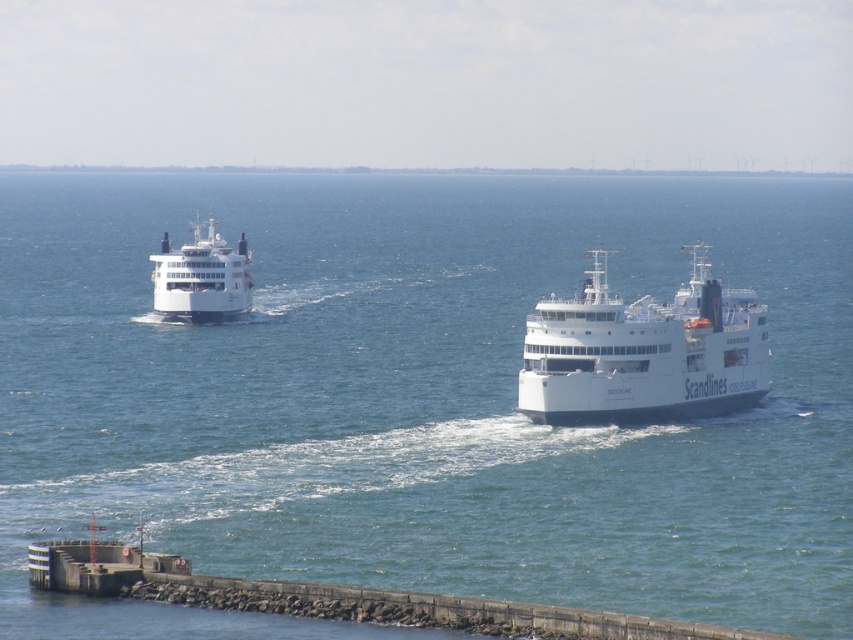
Question: Estimate the real-world distances between objects in this image. Which object is closer to the white matte ferry at center?

Choices:
 (A) blue water at center
 (B) white matte ferry at left

Answer: (B)

Question: Can you confirm if blue water at center is positioned to the right of white matte ferry at left?

Choices:
 (A) no
 (B) yes

Answer: (B)

Question: Observing the image, what is the correct spatial positioning of white matte ferry at center in reference to white matte ferry at left?

Choices:
 (A) left
 (B) right

Answer: (B)

Question: Is blue water at center positioned behind white matte ferry at center?

Choices:
 (A) yes
 (B) no

Answer: (B)

Question: Based on their relative distances, which object is nearer to the blue water at center?

Choices:
 (A) white matte ferry at center
 (B) white matte ferry at left

Answer: (B)

Question: Which object appears farthest from the camera in this image?

Choices:
 (A) white matte ferry at left
 (B) white matte ferry at center

Answer: (A)